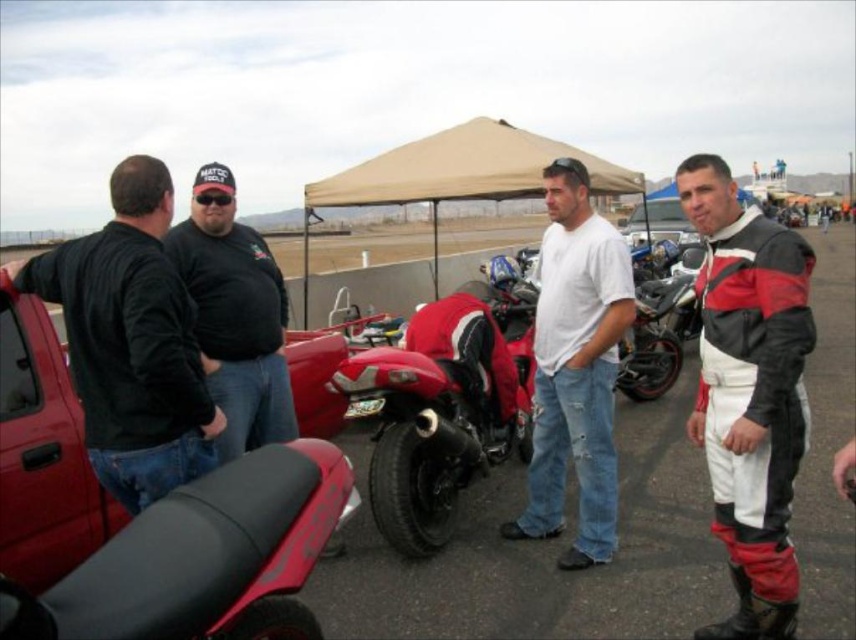
You are a photographer trying to capture a photo of the black rubber motorcycle at center and the leather jacket at right. Based on their positions, which object should you focus on first if you want to include both in the frame without moving the camera?

The black rubber motorcycle at center is located above the leather jacket at right, so you should focus on the black rubber motorcycle at center first to ensure both are in the frame.